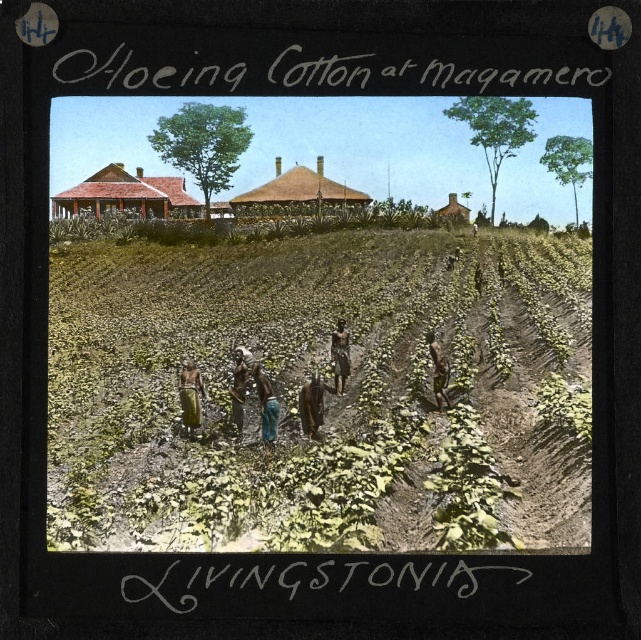
Question: Which is nearer to the brown leather pants at center?

Choices:
 (A) green fabric at center
 (B) brown leather bag at center
 (C) green leafy plants at center

Answer: (B)

Question: Which object appears closest to the camera in this image?

Choices:
 (A) brown fabric at center
 (B) blue fabric at center

Answer: (B)

Question: Which point appears farthest from the camera in this image?

Choices:
 (A) click(312, 420)
 (B) click(231, 394)
 (C) click(274, 420)
 (D) click(344, 387)

Answer: (D)

Question: Where is brown leather bag at center located in relation to brown fabric at center in the image?

Choices:
 (A) left
 (B) right

Answer: (A)

Question: Is blue fabric at center below brown woven fabric at center?

Choices:
 (A) yes
 (B) no

Answer: (A)

Question: In this image, where is blue fabric at center located relative to brown woven fabric at center?

Choices:
 (A) right
 (B) left

Answer: (A)